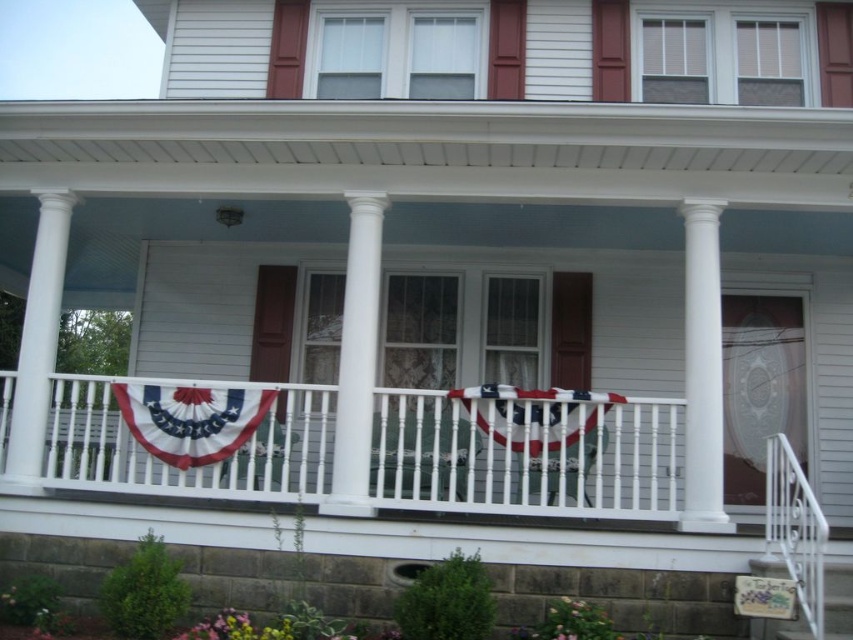
Question: Which point is closer to the camera taking this photo?

Choices:
 (A) (527, 416)
 (B) (219, 388)
 (C) (270, 432)

Answer: (A)

Question: Which of the following is the closest to the observer?

Choices:
 (A) (212, 422)
 (B) (352, 316)
 (C) (496, 440)
 (D) (693, 392)

Answer: (D)

Question: Is white painted wood porch at center further to camera compared to american fabric flag at center?

Choices:
 (A) no
 (B) yes

Answer: (A)

Question: Considering the real-world distances, which object is farthest from the bright red fabric banner at center?

Choices:
 (A) white painted wood porch at center
 (B) white smooth column at right
 (C) american fabric flag at center
 (D) white smooth column at center

Answer: (B)

Question: Can you confirm if white smooth column at right is smaller than bright red fabric banner at center?

Choices:
 (A) no
 (B) yes

Answer: (A)

Question: Is white painted wood porch at center to the left of white smooth column at right from the viewer's perspective?

Choices:
 (A) yes
 (B) no

Answer: (A)